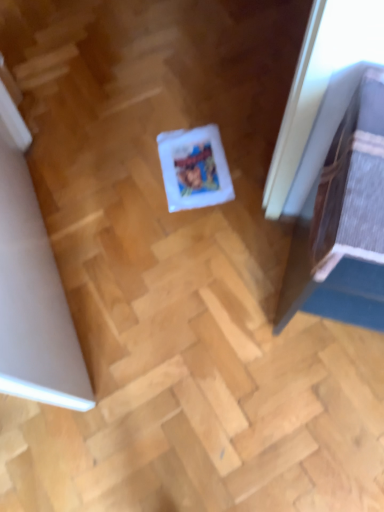
Locate an element on the screen. The height and width of the screenshot is (512, 384). vacant location below wooden door at right (from a real-world perspective) is located at coordinates (300, 292).